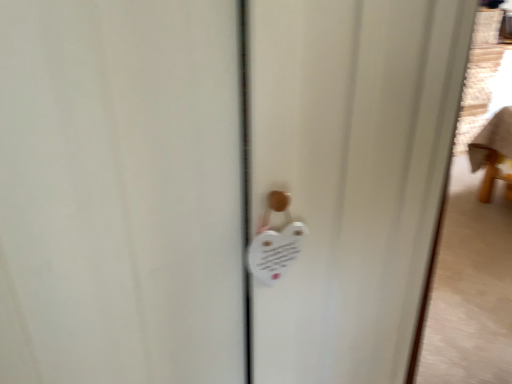
Question: Is white plastic lock at center spatially inside white matte heart-shaped magnet at center, or outside of it?

Choices:
 (A) inside
 (B) outside

Answer: (B)

Question: In terms of height, does white plastic lock at center look taller or shorter compared to white matte heart-shaped magnet at center?

Choices:
 (A) tall
 (B) short

Answer: (A)

Question: Is white plastic lock at center wider or thinner than white matte heart-shaped magnet at center?

Choices:
 (A) wide
 (B) thin

Answer: (B)

Question: Is point (430, 132) positioned closer to the camera than point (307, 230)?

Choices:
 (A) closer
 (B) farther

Answer: (B)

Question: In terms of height, does white matte heart-shaped magnet at center look taller or shorter compared to white plastic lock at center?

Choices:
 (A) short
 (B) tall

Answer: (A)

Question: Visually, is white matte heart-shaped magnet at center positioned to the left or to the right of white plastic lock at center?

Choices:
 (A) left
 (B) right

Answer: (B)

Question: From a real-world perspective, relative to white plastic lock at center, is white matte heart-shaped magnet at center vertically above or below?

Choices:
 (A) below
 (B) above

Answer: (A)